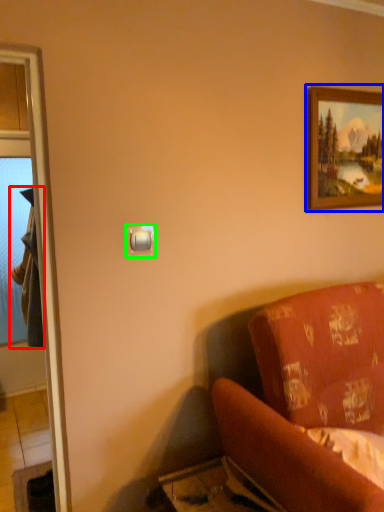
Question: Considering the real-world distances, which object is closest to robe (highlighted by a red box)? picture frame (highlighted by a blue box) or light switch (highlighted by a green box).

Choices:
 (A) picture frame
 (B) light switch

Answer: (B)